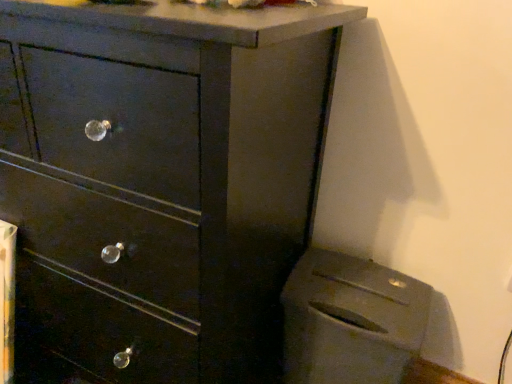
Question: Choose the correct answer: Is matte black dresser at center inside matte gray trash can at lower right or outside it?

Choices:
 (A) outside
 (B) inside

Answer: (A)

Question: Considering the positions of matte black dresser at center and matte gray trash can at lower right in the image, is matte black dresser at center bigger or smaller than matte gray trash can at lower right?

Choices:
 (A) big
 (B) small

Answer: (A)

Question: From a real-world perspective, relative to matte gray trash can at lower right, is matte black dresser at center vertically above or below?

Choices:
 (A) below
 (B) above

Answer: (B)

Question: From the image's perspective, is matte gray trash can at lower right positioned above or below matte black dresser at center?

Choices:
 (A) above
 (B) below

Answer: (B)

Question: In terms of height, does matte gray trash can at lower right look taller or shorter compared to matte black dresser at center?

Choices:
 (A) short
 (B) tall

Answer: (A)

Question: Is matte gray trash can at lower right inside or outside of matte black dresser at center?

Choices:
 (A) outside
 (B) inside

Answer: (A)

Question: Visually, is matte gray trash can at lower right positioned to the left or to the right of matte black dresser at center?

Choices:
 (A) left
 (B) right

Answer: (B)